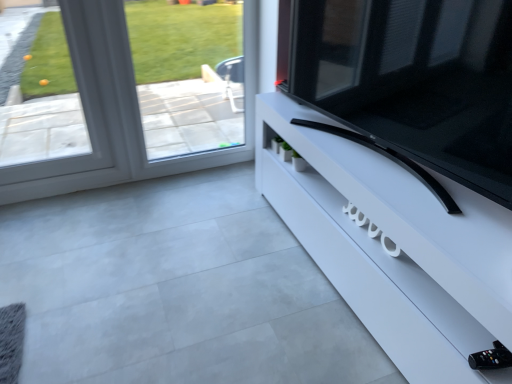
Question: Considering the relative sizes of clear glass window at upper left and white glossy tv stand at right in the image provided, is clear glass window at upper left smaller than white glossy tv stand at right?

Choices:
 (A) no
 (B) yes

Answer: (B)

Question: Is clear glass window at upper left closer to the viewer compared to white glossy tv stand at right?

Choices:
 (A) no
 (B) yes

Answer: (A)

Question: Does clear glass window at upper left have a lesser width compared to white glossy tv stand at right?

Choices:
 (A) yes
 (B) no

Answer: (A)

Question: Is clear glass window at upper left positioned beyond the bounds of white glossy tv stand at right?

Choices:
 (A) yes
 (B) no

Answer: (A)

Question: Could you tell me if clear glass window at upper left is turned towards white glossy tv stand at right?

Choices:
 (A) yes
 (B) no

Answer: (A)

Question: Based on their positions, is white glossy tv stand at right located to the left or right of black glossy tv at right?

Choices:
 (A) left
 (B) right

Answer: (B)

Question: Based on their sizes in the image, would you say white glossy tv stand at right is bigger or smaller than black glossy tv at right?

Choices:
 (A) big
 (B) small

Answer: (A)

Question: From the image's perspective, relative to black glossy tv at right, is white glossy tv stand at right above or below?

Choices:
 (A) below
 (B) above

Answer: (A)

Question: Is white glossy tv stand at right taller or shorter than black glossy tv at right?

Choices:
 (A) short
 (B) tall

Answer: (A)

Question: Is white glossy tv stand at right spatially inside clear glass window at upper left, or outside of it?

Choices:
 (A) outside
 (B) inside

Answer: (A)

Question: In terms of width, does white glossy tv stand at right look wider or thinner when compared to clear glass window at upper left?

Choices:
 (A) thin
 (B) wide

Answer: (B)

Question: In terms of height, does white glossy tv stand at right look taller or shorter compared to clear glass window at upper left?

Choices:
 (A) tall
 (B) short

Answer: (B)

Question: From a real-world perspective, relative to clear glass window at upper left, is white glossy tv stand at right vertically above or below?

Choices:
 (A) below
 (B) above

Answer: (A)

Question: Is clear glass window at upper left wider or thinner than white glossy tv stand at right?

Choices:
 (A) thin
 (B) wide

Answer: (A)

Question: Considering the positions of point (132, 165) and point (439, 269), is point (132, 165) closer or farther from the camera than point (439, 269)?

Choices:
 (A) farther
 (B) closer

Answer: (A)